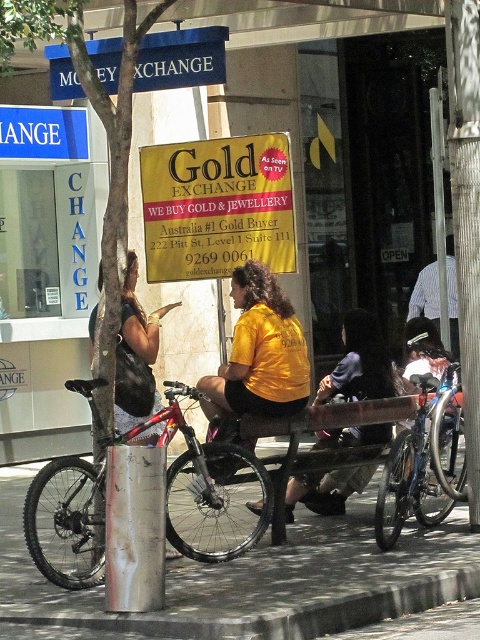
Question: Is smooth concrete pavement at center to the left of gold/yellow paper sign at center from the viewer's perspective?

Choices:
 (A) no
 (B) yes

Answer: (A)

Question: Which of these objects is positioned farthest from the smooth brown tree trunk at center?

Choices:
 (A) blue plastic sign at upper left
 (B) rusty metal pole at center
 (C) gold/yellow paper sign at center

Answer: (A)

Question: Observing the image, what is the correct spatial positioning of blue fabric sign at upper center in reference to blue plastic sign at upper left?

Choices:
 (A) above
 (B) below

Answer: (A)

Question: Is red matte bicycle at center above smooth brown tree trunk at center?

Choices:
 (A) no
 (B) yes

Answer: (A)

Question: Which object appears farthest from the camera in this image?

Choices:
 (A) blue fabric sign at upper center
 (B) red matte bicycle at center

Answer: (A)

Question: Which object is closer to the camera taking this photo?

Choices:
 (A) gold/yellow paper sign at center
 (B) striped shirt at center
 (C) shiny metallic bicycle at center
 (D) smooth concrete pavement at center

Answer: (D)